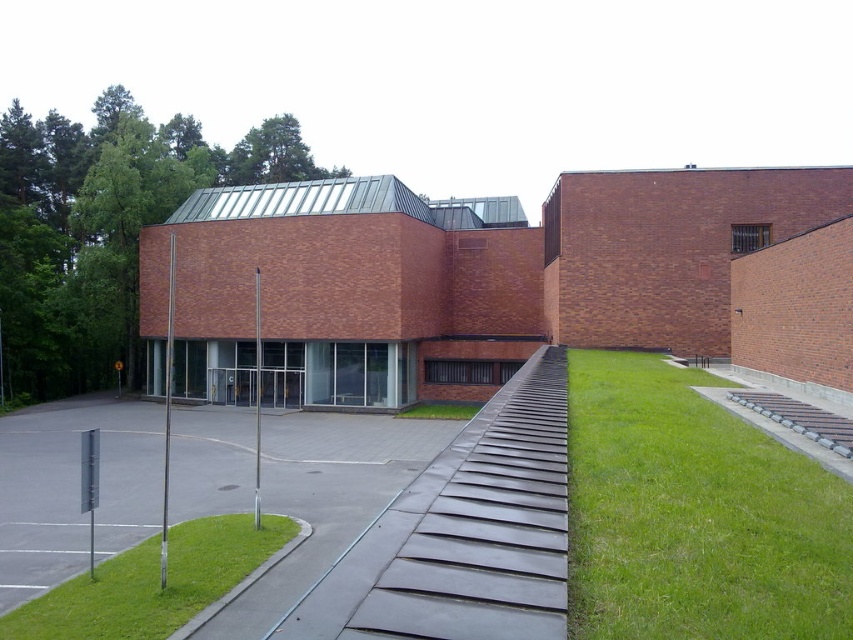
Question: Considering the real-world distances, which object is closest to the green grass at lower right?

Choices:
 (A) green grass at lower left
 (B) green grass at lower center
 (C) gray concrete path at center

Answer: (A)

Question: Does green grass at lower right appear on the right side of green grass at lower left?

Choices:
 (A) no
 (B) yes

Answer: (B)

Question: Is gray concrete path at center thinner than green grass at lower left?

Choices:
 (A) yes
 (B) no

Answer: (B)

Question: Does gray concrete path at center appear under green grass at lower center?

Choices:
 (A) no
 (B) yes

Answer: (B)

Question: Which point is closer to the camera?

Choices:
 (A) (804, 579)
 (B) (305, 465)
 (C) (148, 573)

Answer: (A)

Question: Which point is closer to the camera taking this photo?

Choices:
 (A) (782, 490)
 (B) (82, 600)
 (C) (479, 408)

Answer: (A)